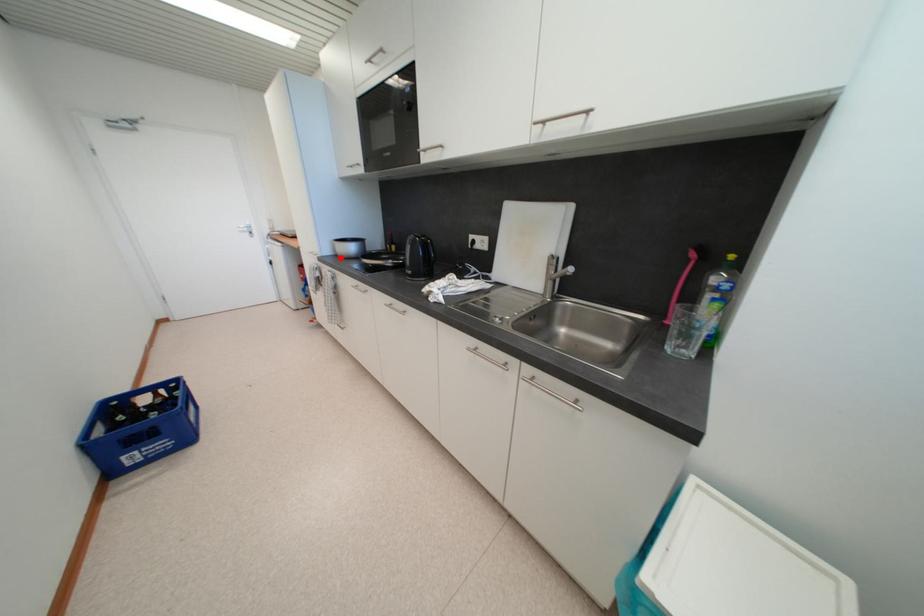
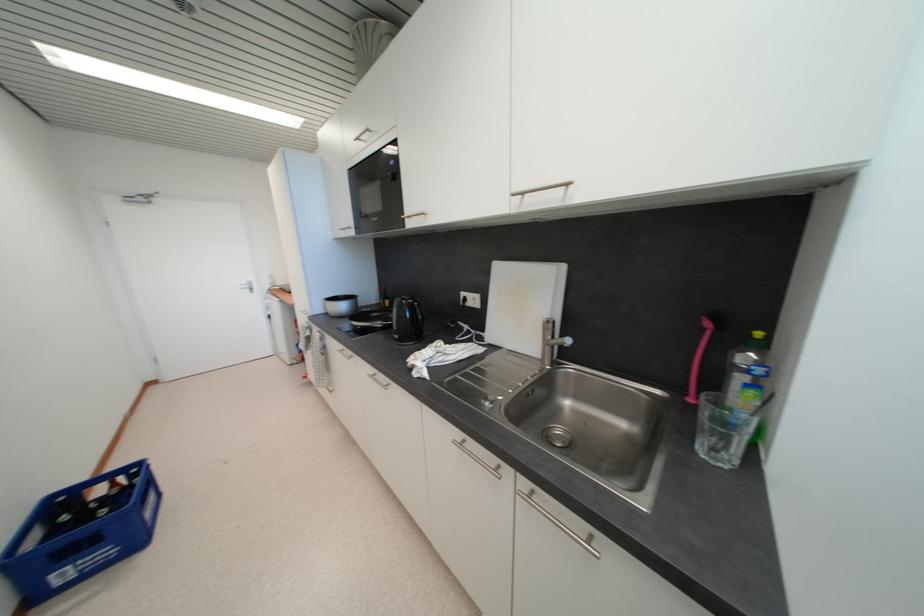
The point at the highlighted location is marked in the first image. Where is the corresponding point in the second image?

(332, 315)